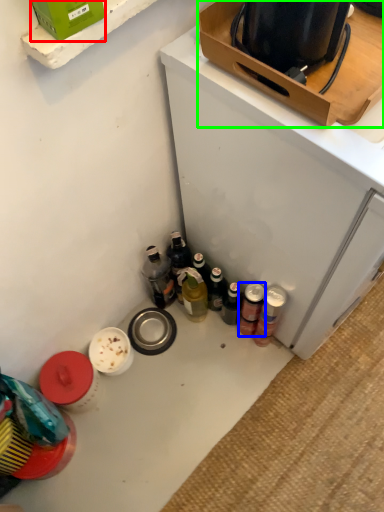
Question: Which object is the farthest from box (highlighted by a red box)? Choose among these: beverage (highlighted by a blue box) or box (highlighted by a green box).

Choices:
 (A) beverage
 (B) box

Answer: (A)